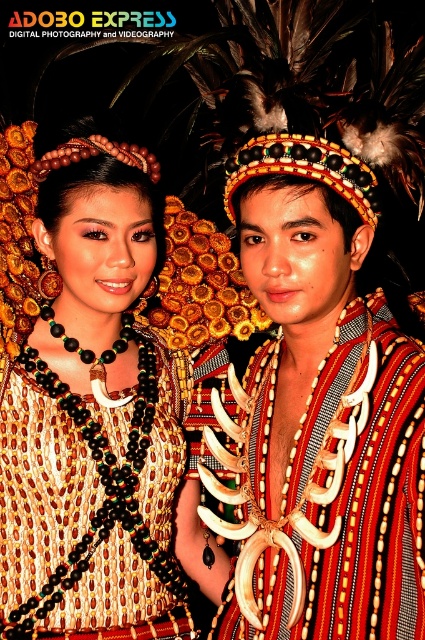
Does black beaded necklace at center appear over shiny gold necklace at center?

Indeed, black beaded necklace at center is positioned over shiny gold necklace at center.

How much distance is there between black beaded necklace at center and shiny gold necklace at center?

black beaded necklace at center is 9.97 inches from shiny gold necklace at center.

The image size is (425, 640). In order to click on black beaded necklace at center in this screenshot , I will do `click(90, 406)`.

Where is `black beaded necklace at center`? The height and width of the screenshot is (640, 425). black beaded necklace at center is located at coordinates (90, 406).